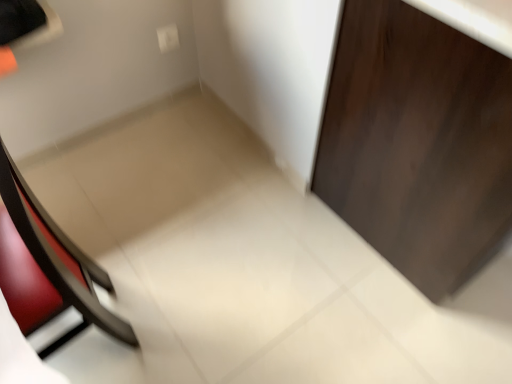
Where is `free space behind matte black chair at left`? free space behind matte black chair at left is located at coordinates (133, 232).